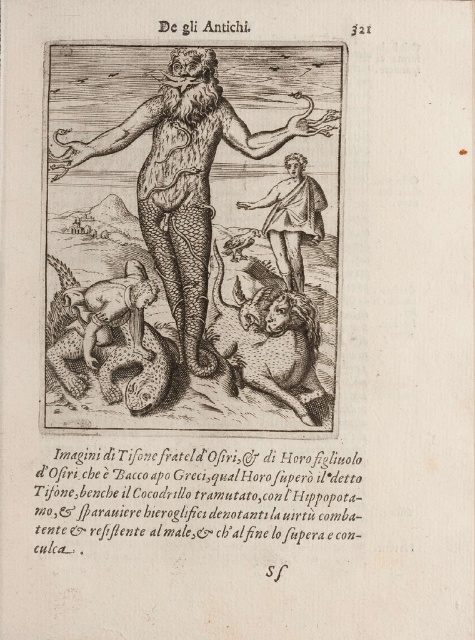
Question: Among these points, which one is farthest from the camera?

Choices:
 (A) (219, 97)
 (B) (281, 257)

Answer: (B)

Question: Which point is farther to the camera?

Choices:
 (A) smooth white toga at center
 (B) brown textured skin deity at center

Answer: (A)

Question: Which point is closer to the camera?

Choices:
 (A) (292, 269)
 (B) (206, 259)

Answer: (B)

Question: Does brown textured skin deity at center have a greater width compared to smooth white toga at center?

Choices:
 (A) yes
 (B) no

Answer: (A)

Question: Is the position of brown textured skin deity at center more distant than that of smooth white toga at center?

Choices:
 (A) no
 (B) yes

Answer: (A)

Question: Can you confirm if brown textured skin deity at center is bigger than smooth white toga at center?

Choices:
 (A) no
 (B) yes

Answer: (B)